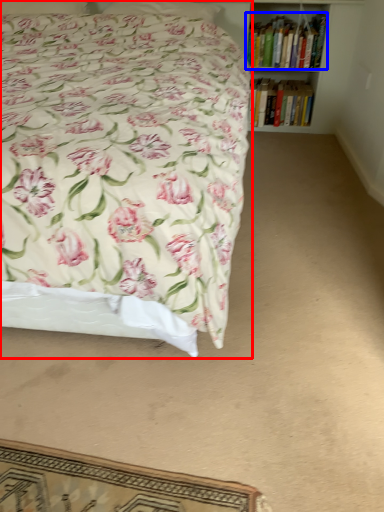
Question: Which point is closer to the camera, bed (highlighted by a red box) or book (highlighted by a blue box)?

Choices:
 (A) bed
 (B) book

Answer: (A)